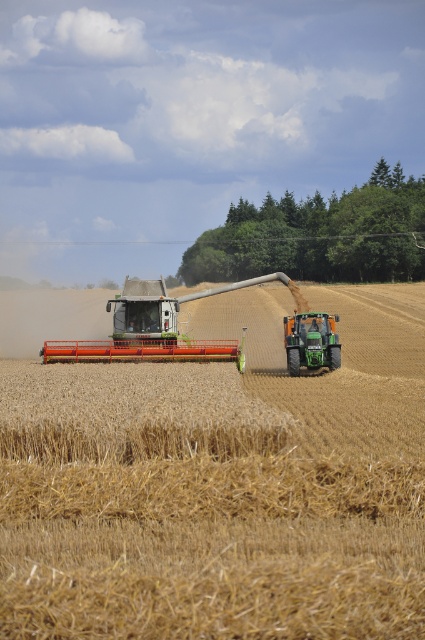
Question: Is golden straw field at center above green matte tractor at center?

Choices:
 (A) yes
 (B) no

Answer: (B)

Question: Among these points, which one is farthest from the camera?

Choices:
 (A) (195, 298)
 (B) (280, 460)
 (C) (323, 355)

Answer: (A)

Question: Among these objects, which one is farthest from the camera?

Choices:
 (A) green matte tractor at center
 (B) golden straw field at center
 (C) orange metallic plow at center

Answer: (A)

Question: Which of the following is the farthest from the observer?

Choices:
 (A) (325, 355)
 (B) (118, 301)
 (C) (152, 577)

Answer: (B)

Question: Does golden straw field at center appear on the left side of green matte tractor at center?

Choices:
 (A) no
 (B) yes

Answer: (B)

Question: Does golden straw field at center have a larger size compared to orange metallic plow at center?

Choices:
 (A) no
 (B) yes

Answer: (B)